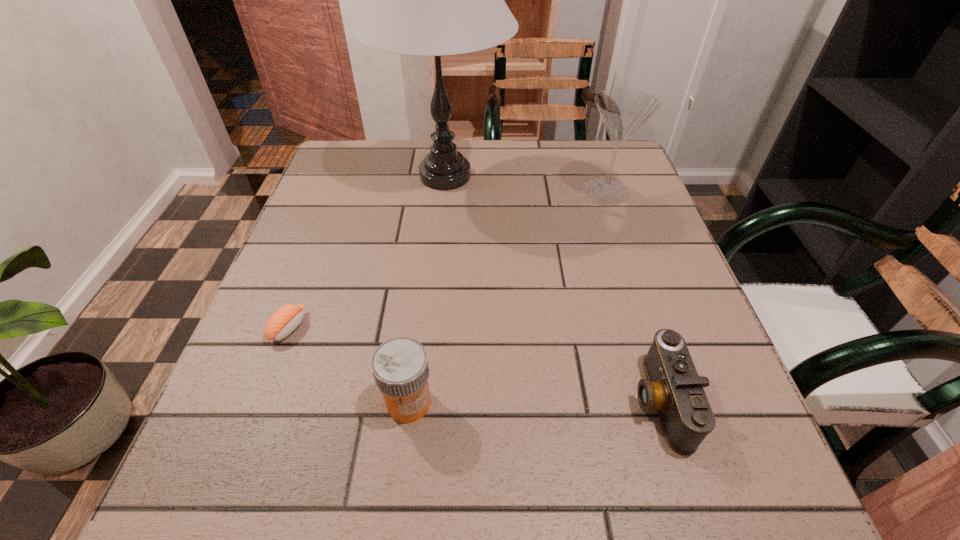
The image size is (960, 540). I want to click on free spot located 0.130m on the lens of the camera, so click(550, 401).

Find the location of a particular element. vacant space situated 0.180m on the lens of the camera is located at coordinates (518, 401).

Locate an element on the screen. Image resolution: width=960 pixels, height=540 pixels. vacant space situated 0.160m on the right of the sushi is located at coordinates (393, 327).

Find the location of a particular element. The image size is (960, 540). lamp located at the far edge is located at coordinates (435, 0).

Find the location of a particular element. The image size is (960, 540). flute glass that is at the far edge is located at coordinates (623, 111).

The image size is (960, 540). What are the coordinates of `object that is at the near edge` in the screenshot? It's located at coord(673,387).

This screenshot has height=540, width=960. In order to click on lamp at the left edge in this screenshot , I will do `click(435, 0)`.

Locate an element on the screen. The height and width of the screenshot is (540, 960). sushi situated at the left edge is located at coordinates (284, 321).

Where is `flute glass at the right edge`? Image resolution: width=960 pixels, height=540 pixels. flute glass at the right edge is located at coordinates (623, 111).

Where is `camera present at the right edge`? camera present at the right edge is located at coordinates (673, 387).